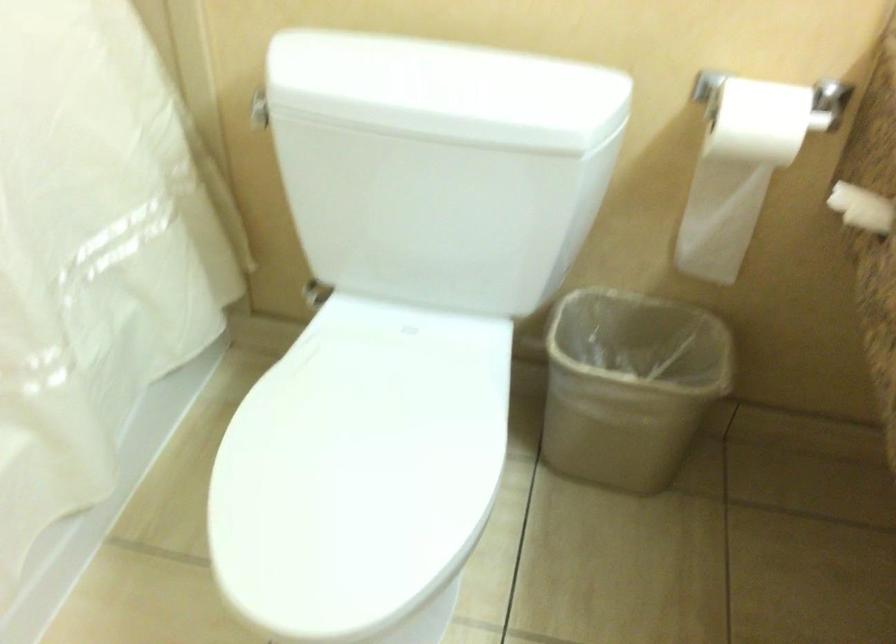
Image resolution: width=896 pixels, height=644 pixels. What do you see at coordinates (259, 108) in the screenshot?
I see `the toilet flush lever` at bounding box center [259, 108].